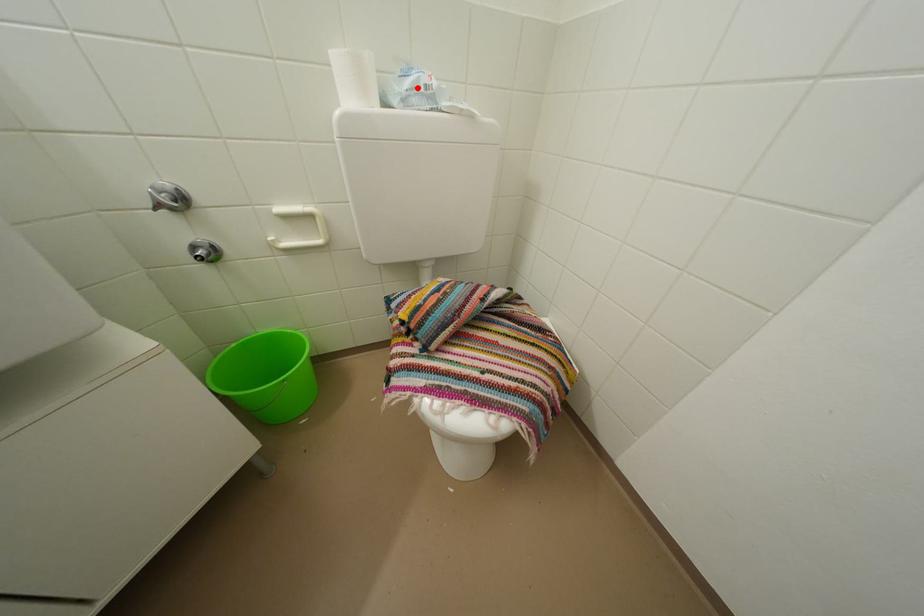
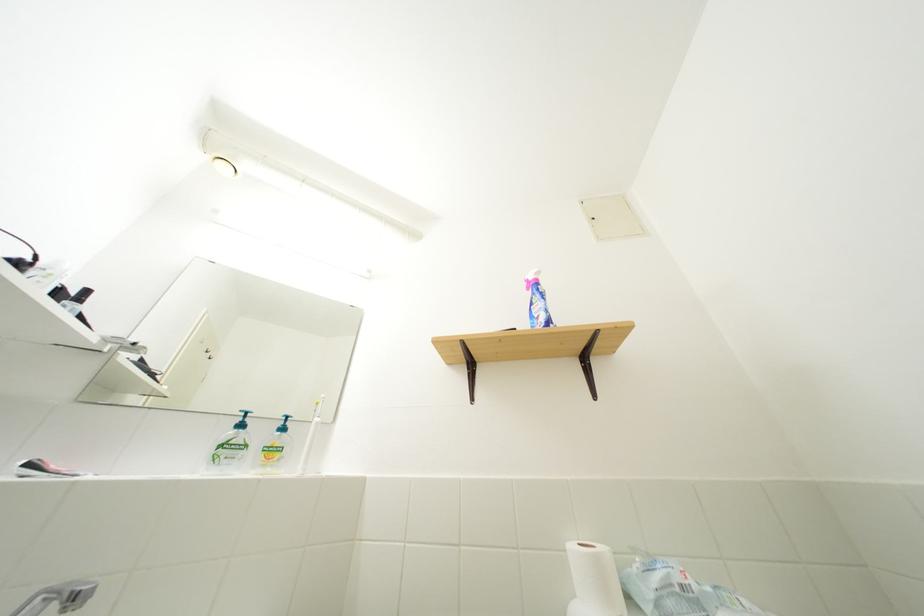
In the second image, find the point that corresponds to the highlighted location in the first image.

(665, 585)